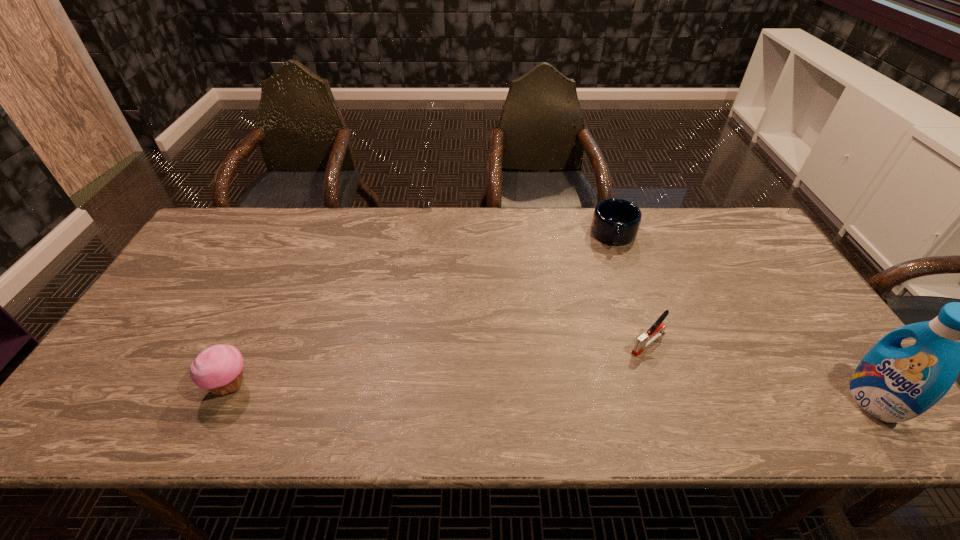
The image size is (960, 540). In order to click on cupcake in this screenshot , I will do `click(218, 368)`.

This screenshot has height=540, width=960. I want to click on the leftmost object, so click(x=218, y=368).

Find the location of `detergent`. detergent is located at coordinates (894, 384).

Locate an element on the screen. The image size is (960, 540). the tallest object is located at coordinates (894, 384).

Locate an element on the screen. The height and width of the screenshot is (540, 960). the farthest object is located at coordinates (615, 221).

At what (x,y) coordinates should I click in order to perform the action: click on the second farthest object. Please return your answer as a coordinate pair (x, y). Looking at the image, I should click on (657, 329).

In order to click on free point located on the left of the second tallest object in this screenshot , I will do pyautogui.click(x=134, y=386).

Where is `free region located 0.220m with the handle on the side of the farthest object`? The height and width of the screenshot is (540, 960). free region located 0.220m with the handle on the side of the farthest object is located at coordinates (614, 303).

Where is `blank space located 0.160m with the handle on the side of the farthest object`? Image resolution: width=960 pixels, height=540 pixels. blank space located 0.160m with the handle on the side of the farthest object is located at coordinates click(x=614, y=288).

Locate an element on the screen. The height and width of the screenshot is (540, 960). blank space located 0.400m with the handle on the side of the farthest object is located at coordinates (614, 356).